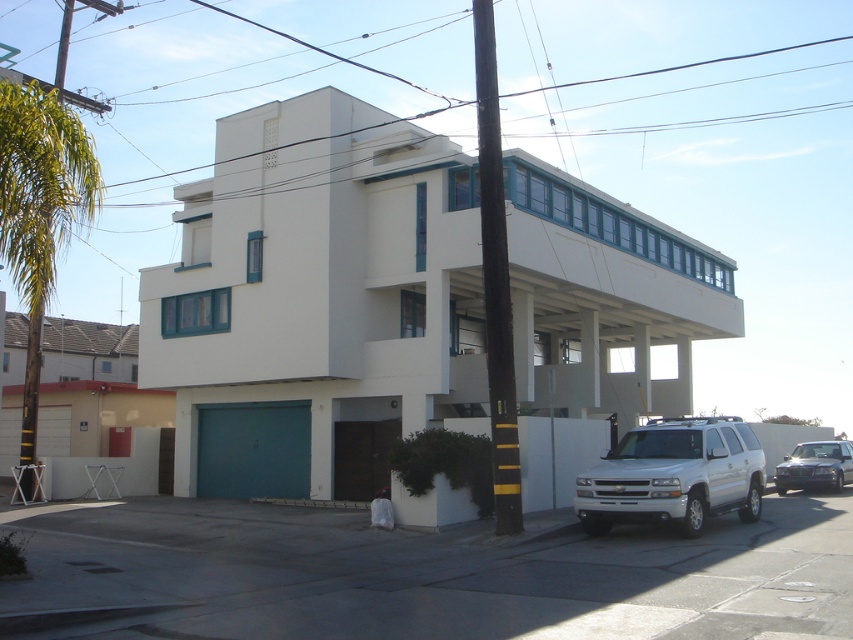
Which is above, green leafy palm tree at left or white glossy suv at lower right?

green leafy palm tree at left is above.

Can you confirm if green leafy palm tree at left is thinner than white glossy suv at lower right?

In fact, green leafy palm tree at left might be wider than white glossy suv at lower right.

The width and height of the screenshot is (853, 640). Describe the element at coordinates (39, 212) in the screenshot. I see `green leafy palm tree at left` at that location.

This screenshot has height=640, width=853. In order to click on green leafy palm tree at left in this screenshot , I will do `click(39, 212)`.

The image size is (853, 640). What do you see at coordinates (39, 212) in the screenshot?
I see `green leafy palm tree at left` at bounding box center [39, 212].

Who is more distant from viewer, (10, 259) or (805, 483)?

The point (805, 483) is more distant.

I want to click on green leafy palm tree at left, so click(x=39, y=212).

Who is higher up, white glossy suv at lower right or metallic silver sedan at lower right?

white glossy suv at lower right is higher up.

Who is shorter, white glossy suv at lower right or metallic silver sedan at lower right?

Standing shorter between the two is metallic silver sedan at lower right.

Measure the distance between white glossy suv at lower right and camera.

white glossy suv at lower right is 43.60 feet from camera.

Find the location of a particular element. The image size is (853, 640). white glossy suv at lower right is located at coordinates (674, 476).